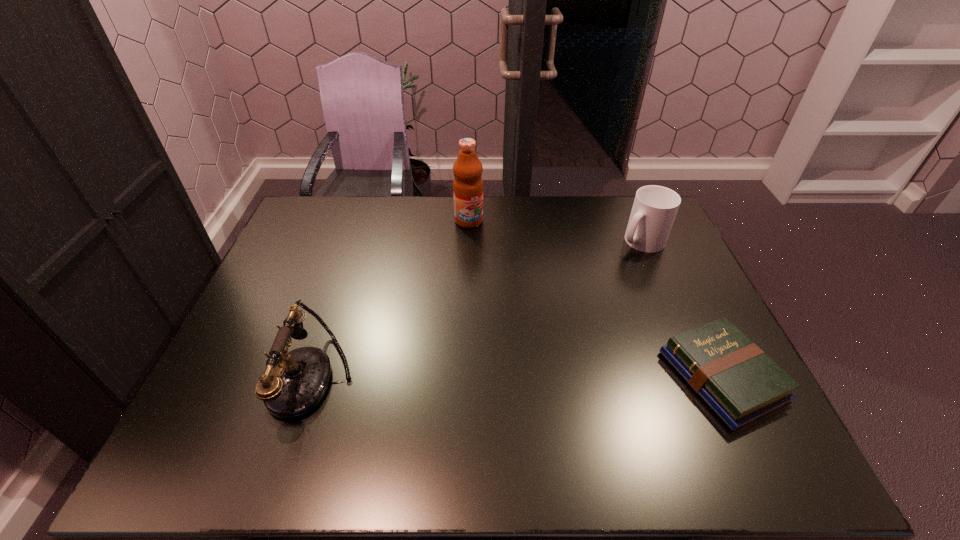
Image resolution: width=960 pixels, height=540 pixels. What are the coordinates of `free space on the desktop that is between the telephone and the shortest object and is positioned on the handle side of the mug` in the screenshot? It's located at (511, 377).

Where is `free space on the desktop that is between the leftmost object and the shortest object and is positioned on the front label of the fruit juice`? This screenshot has height=540, width=960. free space on the desktop that is between the leftmost object and the shortest object and is positioned on the front label of the fruit juice is located at coordinates (560, 377).